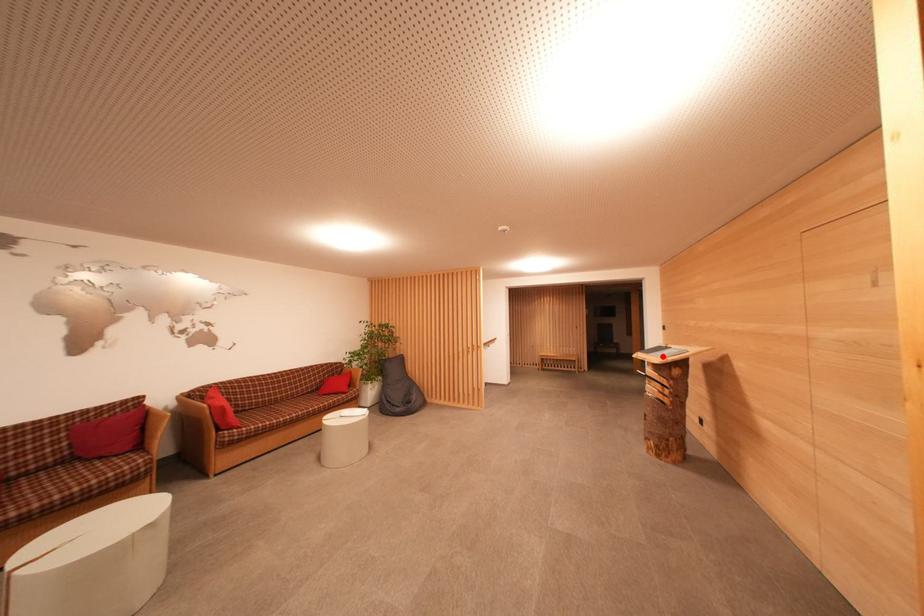
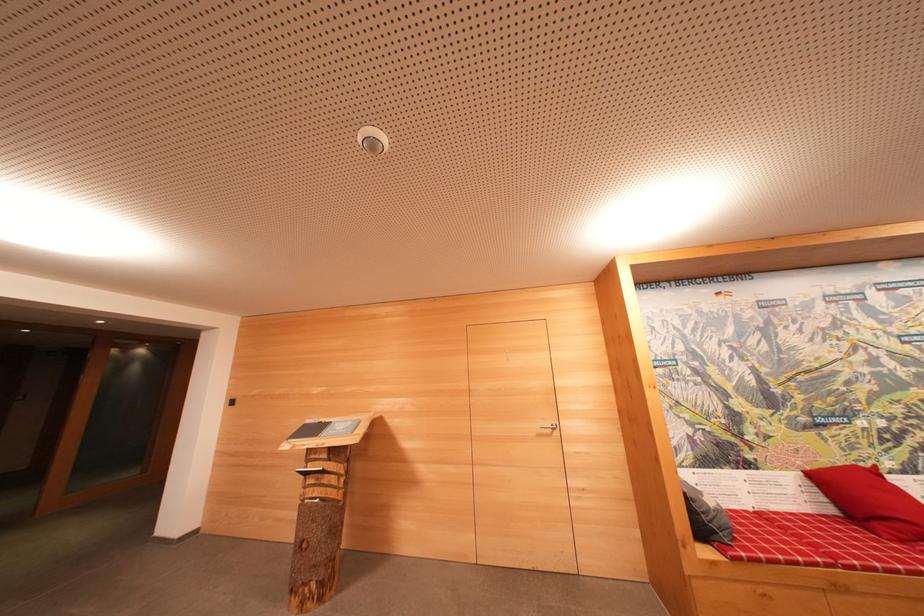
Question: A red point is marked in image1. In image2, is the corresponding 3D point closer to the camera or farther? Reply with the corresponding letter.

Choices:
 (A) The corresponding 3D point is closer.
 (B) The corresponding 3D point is farther.

Answer: (B)